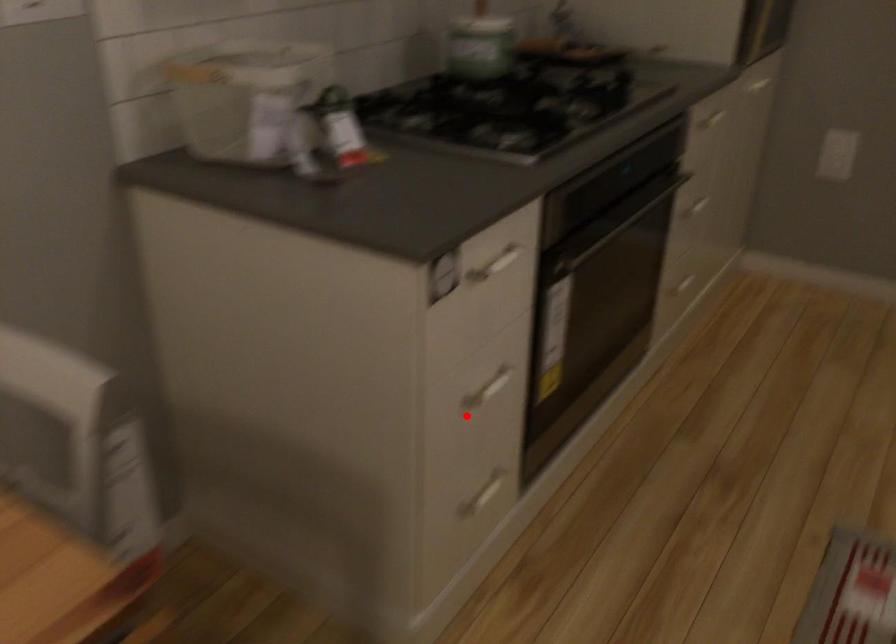
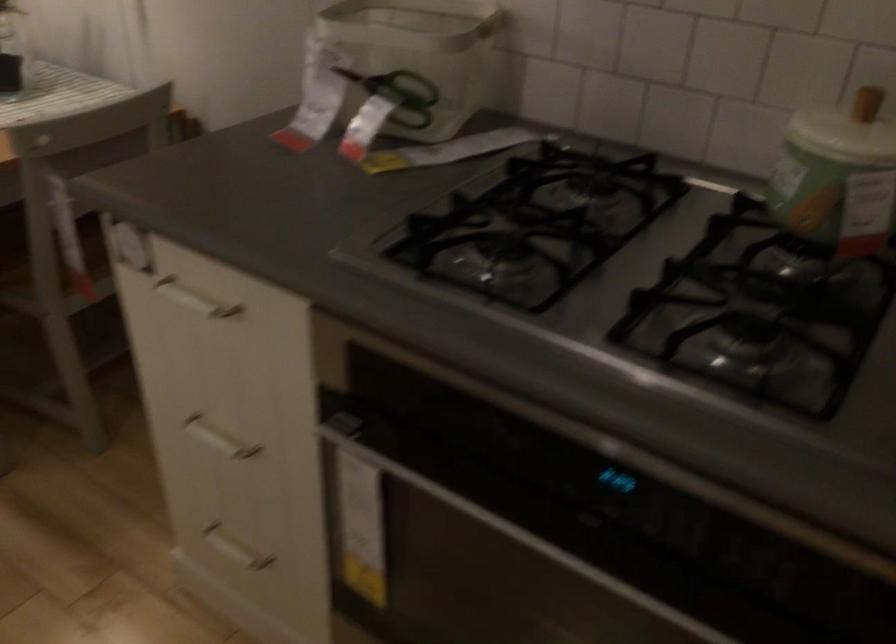
Question: I am providing you with two images of the same scene from different viewpoints. A red point is shown in image1. For the corresponding object point in image2, is it positioned nearer or farther from the camera?

Choices:
 (A) Nearer
 (B) Farther

Answer: (A)